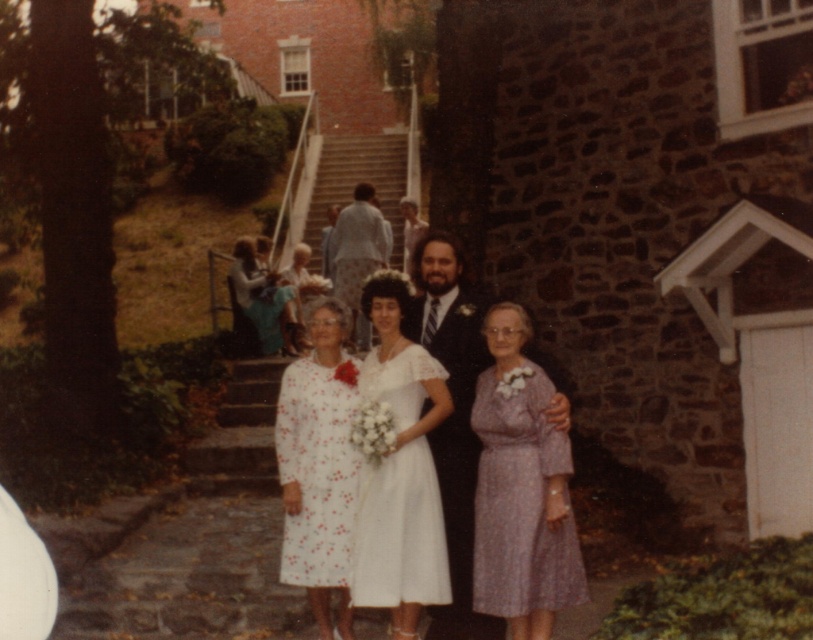
Which is below, white lace dress at center or light blue fabric shirt at center?

white lace dress at center is lower down.

Who is more distant from viewer, (x=359, y=388) or (x=355, y=308)?

Point (x=355, y=308)

Identify the location of white lace dress at center. (398, 532).

The height and width of the screenshot is (640, 813). What do you see at coordinates (520, 500) in the screenshot?
I see `purple satin dress at lower right` at bounding box center [520, 500].

In the scene shown: Who is more forward, (494, 388) or (451, 444)?

Point (494, 388) is in front.

Which is in front, point (535, 470) or point (462, 371)?

Positioned in front is point (535, 470).

Where is `purple satin dress at lower right`? purple satin dress at lower right is located at coordinates (520, 500).

Can you confirm if purple satin dress at lower right is shorter than matte green dress at center?

Yes.

Does purple satin dress at lower right appear under matte green dress at center?

Correct, purple satin dress at lower right is located below matte green dress at center.

Is point (496, 616) farther from viewer compared to point (254, 273)?

No.

Locate an element on the screen. The image size is (813, 640). purple satin dress at lower right is located at coordinates (520, 500).